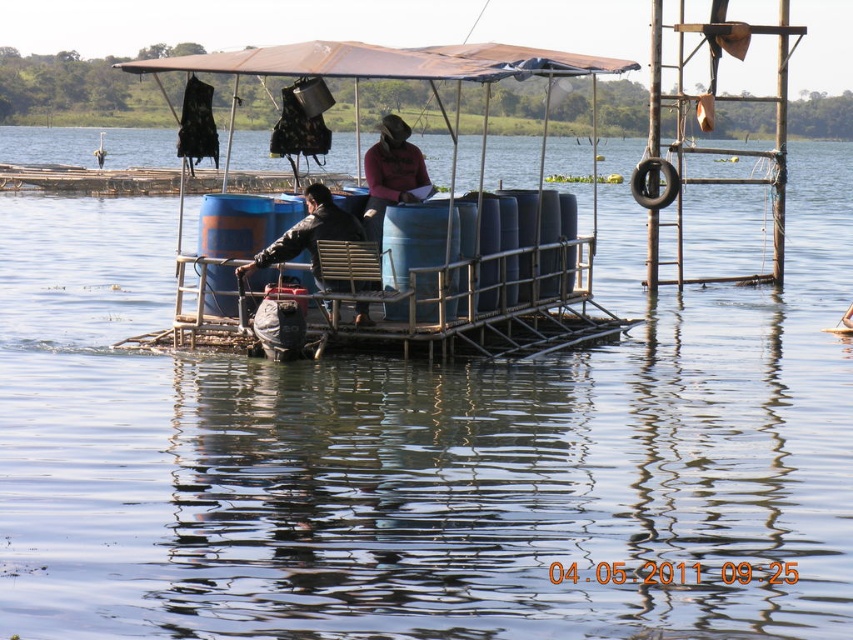
Question: Based on their relative distances, which object is nearer to the leather jacket at center?

Choices:
 (A) matte pink shirt at center
 (B) blue plastic barrels at center

Answer: (A)

Question: Which object appears closest to the camera in this image?

Choices:
 (A) leather jacket at center
 (B) blue plastic barrels at center
 (C) matte pink shirt at center

Answer: (B)

Question: Is leather jacket at center in front of matte pink shirt at center?

Choices:
 (A) yes
 (B) no

Answer: (A)

Question: Considering the relative positions of leather jacket at center and matte pink shirt at center in the image provided, where is leather jacket at center located with respect to matte pink shirt at center?

Choices:
 (A) above
 (B) below

Answer: (B)

Question: Considering the real-world distances, which object is farthest from the matte pink shirt at center?

Choices:
 (A) leather jacket at center
 (B) blue plastic barrels at center

Answer: (B)

Question: Does blue plastic barrels at center have a larger size compared to matte pink shirt at center?

Choices:
 (A) yes
 (B) no

Answer: (A)